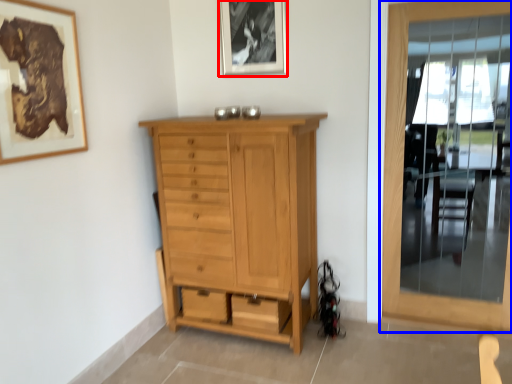
Question: Which point is further to the camera, picture frame (highlighted by a red box) or door (highlighted by a blue box)?

Choices:
 (A) picture frame
 (B) door

Answer: (A)